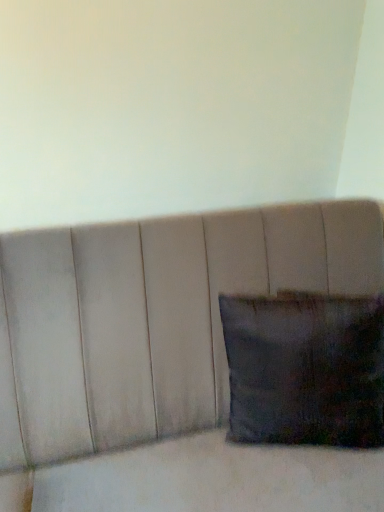
What do you see at coordinates (164, 360) in the screenshot?
I see `suede-like beige cushion at center` at bounding box center [164, 360].

Measure the distance between suede-like beige cushion at center and camera.

The distance of suede-like beige cushion at center from camera is 90.62 centimeters.

Image resolution: width=384 pixels, height=512 pixels. I want to click on suede-like beige cushion at center, so click(164, 360).

You are a GUI agent. You are given a task and a screenshot of the screen. Output one action in this format:
    pyautogui.click(x=<x>, y=<y>)
    Task: Click on the dark fabric pillow at lower right
    The image size is (384, 512).
    Given the screenshot: What is the action you would take?
    pyautogui.click(x=305, y=369)

This screenshot has width=384, height=512. Describe the element at coordinates (305, 369) in the screenshot. I see `dark fabric pillow at lower right` at that location.

Locate an element on the screen. This screenshot has height=512, width=384. suede-like beige cushion at center is located at coordinates (164, 360).

Looking at this image, is dark fabric pillow at lower right to the right of suede-like beige cushion at center from the viewer's perspective?

Indeed, dark fabric pillow at lower right is positioned on the right side of suede-like beige cushion at center.

Is the position of dark fabric pillow at lower right more distant than that of suede-like beige cushion at center?

Yes, dark fabric pillow at lower right is further from the viewer.

Which is less distant, (249, 308) or (213, 234)?

Point (249, 308).

From the image's perspective, is dark fabric pillow at lower right located above suede-like beige cushion at center?

Correct, dark fabric pillow at lower right appears higher than suede-like beige cushion at center in the image.

From a real-world perspective, who is located lower, dark fabric pillow at lower right or suede-like beige cushion at center?

suede-like beige cushion at center.

Considering the sizes of objects dark fabric pillow at lower right and suede-like beige cushion at center in the image provided, who is wider, dark fabric pillow at lower right or suede-like beige cushion at center?

Wider between the two is suede-like beige cushion at center.

Can you confirm if dark fabric pillow at lower right is shorter than suede-like beige cushion at center?

Indeed, dark fabric pillow at lower right has a lesser height compared to suede-like beige cushion at center.

Can you confirm if dark fabric pillow at lower right is smaller than suede-like beige cushion at center?

Yes.

Based on the photo, would you say dark fabric pillow at lower right is inside or outside suede-like beige cushion at center?

dark fabric pillow at lower right can be found inside suede-like beige cushion at center.

Is dark fabric pillow at lower right far from suede-like beige cushion at center?

That's not correct — dark fabric pillow at lower right is a little close to suede-like beige cushion at center.

Could you tell me if dark fabric pillow at lower right is facing suede-like beige cushion at center?

Yes, dark fabric pillow at lower right is aimed at suede-like beige cushion at center.

Image resolution: width=384 pixels, height=512 pixels. What are the coordinates of `furniture below the dark fabric pillow at lower right (from a real-world perspective)` in the screenshot? It's located at (164, 360).

Is suede-like beige cushion at center to the left of dark fabric pillow at lower right from the viewer's perspective?

Indeed, suede-like beige cushion at center is positioned on the left side of dark fabric pillow at lower right.

Is the depth of suede-like beige cushion at center less than that of dark fabric pillow at lower right?

Yes, the depth of suede-like beige cushion at center is less than that of dark fabric pillow at lower right.

Does point (86, 262) lie behind point (317, 295)?

No.

From the image's perspective, which is below, suede-like beige cushion at center or dark fabric pillow at lower right?

suede-like beige cushion at center is shown below in the image.

From a real-world perspective, does suede-like beige cushion at center stand above dark fabric pillow at lower right?

No.

Is suede-like beige cushion at center wider or thinner than dark fabric pillow at lower right?

In the image, suede-like beige cushion at center appears to be wider than dark fabric pillow at lower right.

Which of these two, suede-like beige cushion at center or dark fabric pillow at lower right, stands shorter?

dark fabric pillow at lower right is shorter.

Considering the relative sizes of suede-like beige cushion at center and dark fabric pillow at lower right in the image provided, is suede-like beige cushion at center bigger than dark fabric pillow at lower right?

Correct, suede-like beige cushion at center is larger in size than dark fabric pillow at lower right.

Is suede-like beige cushion at center spatially inside dark fabric pillow at lower right, or outside of it?

suede-like beige cushion at center cannot be found inside dark fabric pillow at lower right.

Are suede-like beige cushion at center and dark fabric pillow at lower right far apart?

No, suede-like beige cushion at center is not far from dark fabric pillow at lower right.

Looking at this image, is dark fabric pillow at lower right at the back of suede-like beige cushion at center?

Yes.

Locate an element on the screen. Image resolution: width=384 pixels, height=512 pixels. furniture on the left of dark fabric pillow at lower right is located at coordinates (164, 360).

Locate an element on the screen. furniture in front of the dark fabric pillow at lower right is located at coordinates (164, 360).

You are a GUI agent. You are given a task and a screenshot of the screen. Output one action in this format:
    pyautogui.click(x=<x>, y=<y>)
    Task: Click on the furniture that is under the dark fabric pillow at lower right (from a real-world perspective)
    
    Given the screenshot: What is the action you would take?
    pyautogui.click(x=164, y=360)